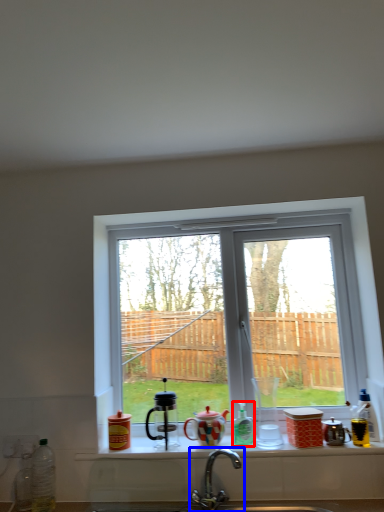
Question: Which point is further to the camera, bottle (highlighted by a red box) or tap (highlighted by a blue box)?

Choices:
 (A) bottle
 (B) tap

Answer: (A)